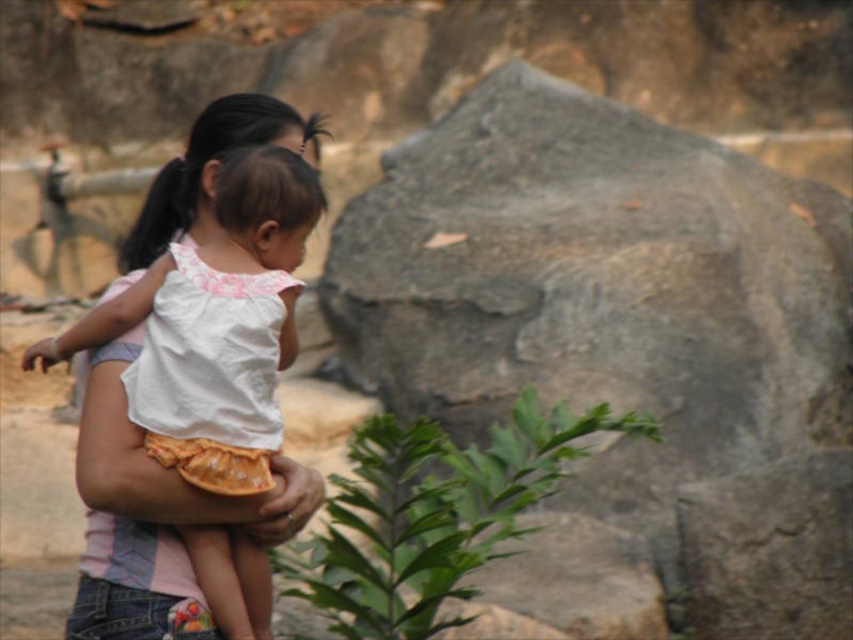
You are a visitor at the zoo and see both the gray rough stone at center and the green leafy plant at center. Which object is larger in size?

The gray rough stone at center is bigger than the green leafy plant at center.

From the picture: You are a zookeeper who needs to place a new sign between the gray rough stone at center and the green leafy plant at center. The sign requires a minimum of 3 feet of space between them to be visible. Can you fit the sign between them?

The gray rough stone at center is 24.58 feet away from the green leafy plant at center, so yes, the sign can be placed between them since the distance is more than the required 3 feet.

You are a photographer standing at the center of the scene. You want to take a photo of the white cotton shirt at center and the black silky hair at center. Given that your camera has a maximum focus range of 100 feet, will both subjects be in focus?

The distance between the white cotton shirt at center and the black silky hair at center is 106.10 feet, which exceeds the camera maximum focus range of 100 feet. Therefore, both subjects cannot be in focus at the same time.